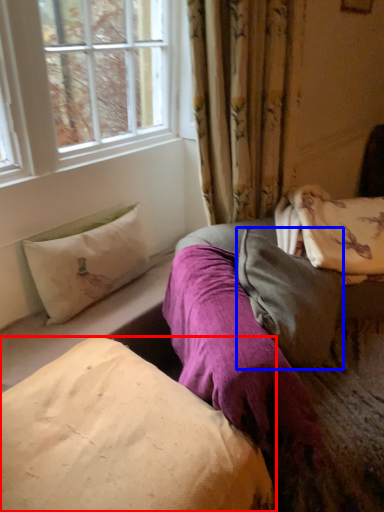
Question: Among these objects, which one is nearest to the camera, pillow (highlighted by a red box) or pillow (highlighted by a blue box)?

Choices:
 (A) pillow
 (B) pillow

Answer: (A)